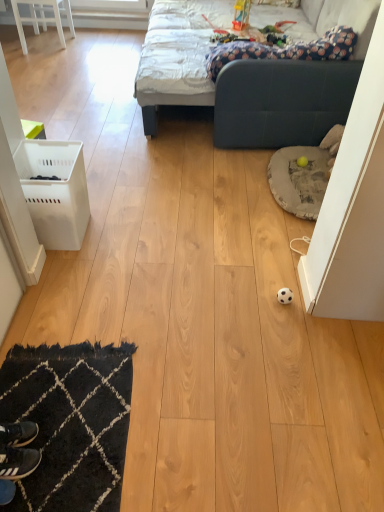
What are the coordinates of `vacant area to the right of black leather shoe at lower left` in the screenshot? It's located at (73, 434).